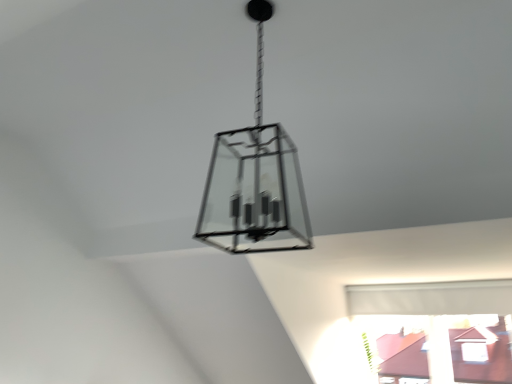
Based on the photo, what is the approximate width of clear glass chandelier at center?

clear glass chandelier at center is 18.53 inches in width.

Where is `clear glass chandelier at center`? The width and height of the screenshot is (512, 384). clear glass chandelier at center is located at coordinates (255, 180).

Measure the distance between clear glass chandelier at center and camera.

The distance of clear glass chandelier at center from camera is 1.17 meters.

The height and width of the screenshot is (384, 512). What do you see at coordinates (255, 180) in the screenshot?
I see `clear glass chandelier at center` at bounding box center [255, 180].

Identify the location of clear glass chandelier at center. (255, 180).